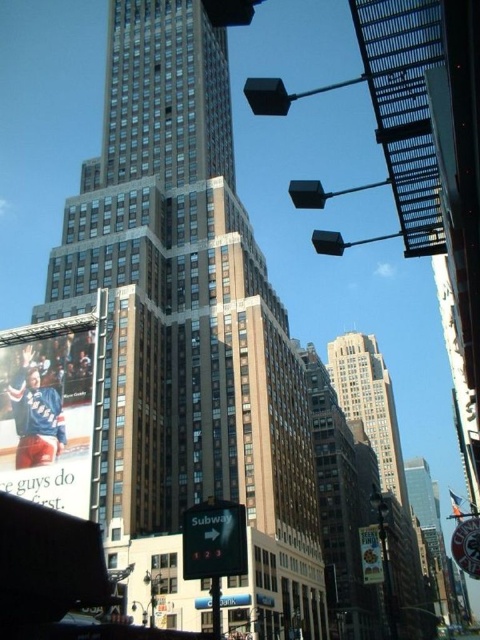
Question: Among these points, which one is farthest from the camera?

Choices:
 (A) (218, 516)
 (B) (470, 534)
 (C) (177, 564)

Answer: (C)

Question: Is green matte sign at lower center in front of metallic silver sign at lower right?

Choices:
 (A) yes
 (B) no

Answer: (B)

Question: Does brown stone building at center have a smaller size compared to white glossy billboard at center?

Choices:
 (A) yes
 (B) no

Answer: (B)

Question: Estimate the real-world distances between objects in this image. Which object is closer to the metallic pole at lower center?

Choices:
 (A) white glossy billboard at center
 (B) brown stone skyscraper at center

Answer: (A)

Question: Estimate the real-world distances between objects in this image. Which object is closer to the brown stone building at center?

Choices:
 (A) metallic silver sign at lower right
 (B) white glossy billboard at center

Answer: (B)

Question: Is brown stone skyscraper at center to the right of white glossy billboard at center from the viewer's perspective?

Choices:
 (A) yes
 (B) no

Answer: (A)